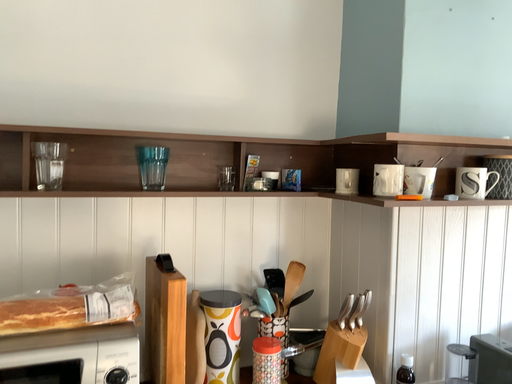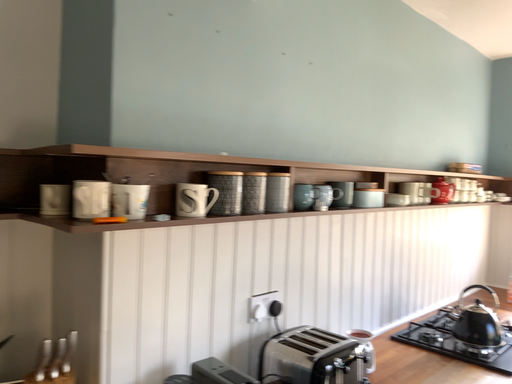
Question: How did the camera likely rotate when shooting the video?

Choices:
 (A) rotated right
 (B) rotated left

Answer: (A)